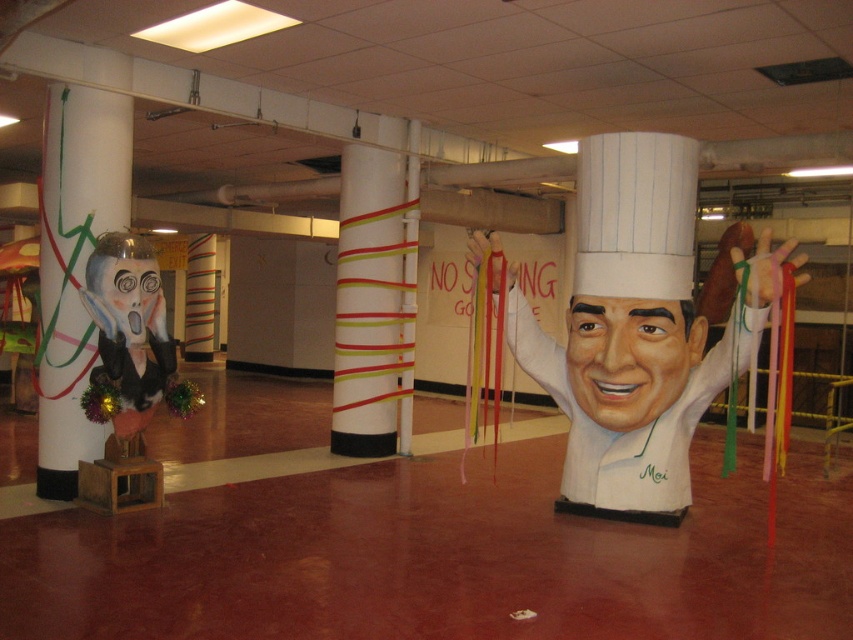
Question: Considering the real-world distances, which object is closest to the white paper chef hat at center?

Choices:
 (A) matte black face at left
 (B) smooth white chef hat at center
 (C) whitecardboardsign at center
 (D) white glossy pillar at left

Answer: (B)

Question: Based on their relative distances, which object is nearer to the smooth white chef hat at center?

Choices:
 (A) white paper chef hat at center
 (B) white striped column at center

Answer: (A)

Question: Is white paper chef hat at center wider than white striped column at center?

Choices:
 (A) yes
 (B) no

Answer: (A)

Question: Can you confirm if white paper chef hat at center is wider than white glossy pillar at left?

Choices:
 (A) no
 (B) yes

Answer: (B)

Question: Is white glossy pillar at left bigger than whitecardboardsign at center?

Choices:
 (A) no
 (B) yes

Answer: (B)

Question: Which point is closer to the camera?

Choices:
 (A) (80, 205)
 (B) (614, 451)
 (C) (113, 323)
 (D) (625, 397)

Answer: (C)